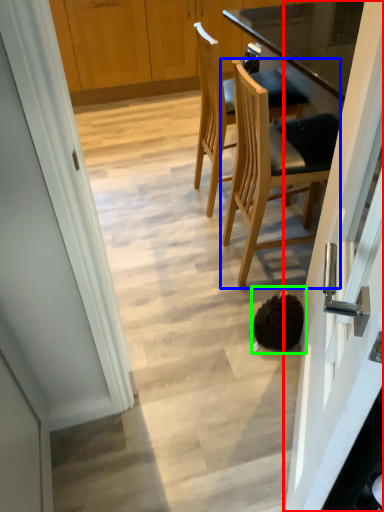
Question: Estimate the real-world distances between objects in this image. Which object is closer to door (highlighted by a red box), chair (highlighted by a blue box) or head (highlighted by a green box)?

Choices:
 (A) chair
 (B) head

Answer: (B)